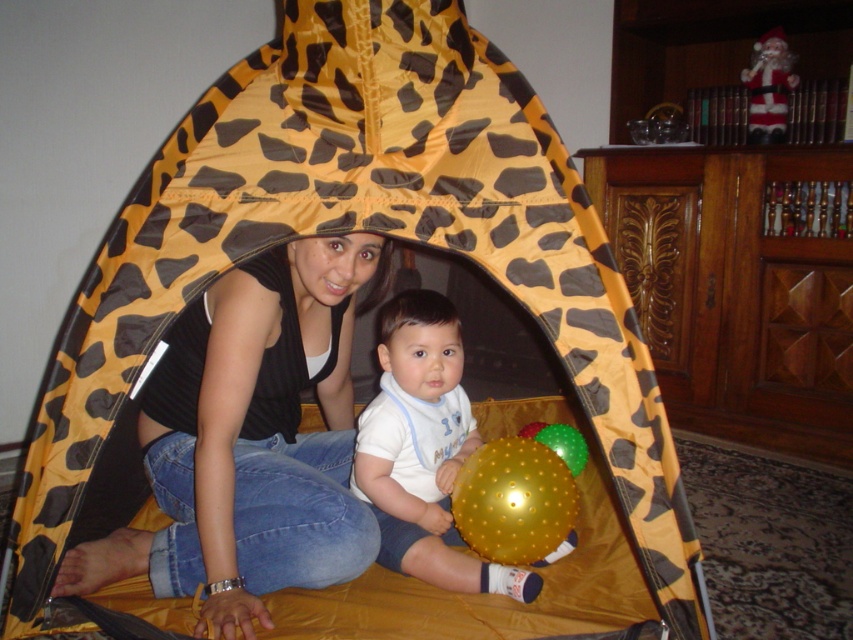
Question: Is matte black tank top at center further to camera compared to santa claus figure at upper right?

Choices:
 (A) no
 (B) yes

Answer: (A)

Question: Based on their relative distances, which object is farther from the matte black tank top at center?

Choices:
 (A) santa claus figure at upper right
 (B) white soft fabric at center

Answer: (A)

Question: Based on their relative distances, which object is nearer to the white soft fabric at center?

Choices:
 (A) matte black tank top at center
 (B) santa claus figure at upper right

Answer: (A)

Question: Which point is closer to the camera?

Choices:
 (A) (366, 522)
 (B) (438, 468)
 (C) (746, 74)

Answer: (A)

Question: In this image, where is matte black tank top at center located relative to white soft fabric at center?

Choices:
 (A) below
 (B) above

Answer: (B)

Question: Can you confirm if white soft fabric at center is bigger than santa claus figure at upper right?

Choices:
 (A) no
 (B) yes

Answer: (B)